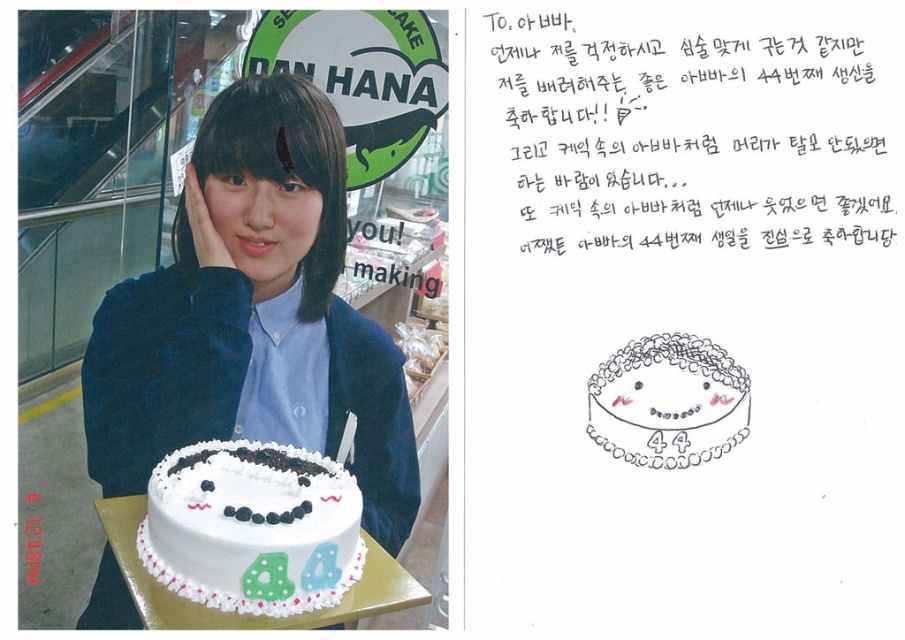
Question: Which object is positioned closest to the white frosted cake at center?

Choices:
 (A) matte blue shirt at center
 (B) white frosted cake with chocolate decorations at lower center

Answer: (B)

Question: Can you confirm if matte blue shirt at center is smaller than white frosted cake with chocolate decorations at lower center?

Choices:
 (A) no
 (B) yes

Answer: (A)

Question: Does white frosted cake with chocolate decorations at lower center appear on the right side of white frosted cake at center?

Choices:
 (A) no
 (B) yes

Answer: (A)

Question: Which of the following is the farthest from the observer?

Choices:
 (A) white frosted cake at center
 (B) matte blue shirt at center

Answer: (B)

Question: Considering the real-world distances, which object is closest to the white frosted cake with chocolate decorations at lower center?

Choices:
 (A) white frosted cake at center
 (B) matte blue shirt at center

Answer: (B)

Question: Does white frosted cake with chocolate decorations at lower center appear on the left side of white frosted cake at center?

Choices:
 (A) yes
 (B) no

Answer: (A)